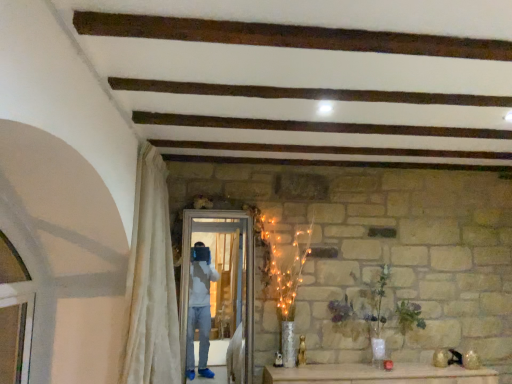
Question: Does white sheer curtain at left appear on the right side of green matte vase at center?

Choices:
 (A) yes
 (B) no

Answer: (B)

Question: Is white sheer curtain at left facing away from green matte vase at center?

Choices:
 (A) no
 (B) yes

Answer: (A)

Question: From a real-world perspective, is white sheer curtain at left physically above green matte vase at center?

Choices:
 (A) no
 (B) yes

Answer: (B)

Question: Is white sheer curtain at left at the left side of green matte vase at center?

Choices:
 (A) no
 (B) yes

Answer: (B)

Question: Is white sheer curtain at left with green matte vase at center?

Choices:
 (A) no
 (B) yes

Answer: (A)

Question: Would you say white glossy screen door at center is inside or outside green matte vase at center?

Choices:
 (A) outside
 (B) inside

Answer: (A)

Question: From a real-world perspective, is white glossy screen door at center positioned above or below green matte vase at center?

Choices:
 (A) below
 (B) above

Answer: (B)

Question: In terms of size, does white glossy screen door at center appear bigger or smaller than green matte vase at center?

Choices:
 (A) small
 (B) big

Answer: (A)

Question: Looking at their shapes, would you say white glossy screen door at center is wider or thinner than green matte vase at center?

Choices:
 (A) wide
 (B) thin

Answer: (B)

Question: Is green matte vase at center spatially inside white sheer curtain at left, or outside of it?

Choices:
 (A) outside
 (B) inside

Answer: (A)

Question: From the image's perspective, is green matte vase at center located above or below white sheer curtain at left?

Choices:
 (A) below
 (B) above

Answer: (A)

Question: From their relative heights in the image, would you say green matte vase at center is taller or shorter than white sheer curtain at left?

Choices:
 (A) tall
 (B) short

Answer: (B)

Question: Considering the positions of green matte vase at center and white sheer curtain at left in the image, is green matte vase at center bigger or smaller than white sheer curtain at left?

Choices:
 (A) big
 (B) small

Answer: (B)

Question: Considering the positions of white sheer curtain at left and green matte vase at center in the image, is white sheer curtain at left bigger or smaller than green matte vase at center?

Choices:
 (A) small
 (B) big

Answer: (B)

Question: In terms of height, does white sheer curtain at left look taller or shorter compared to green matte vase at center?

Choices:
 (A) tall
 (B) short

Answer: (A)